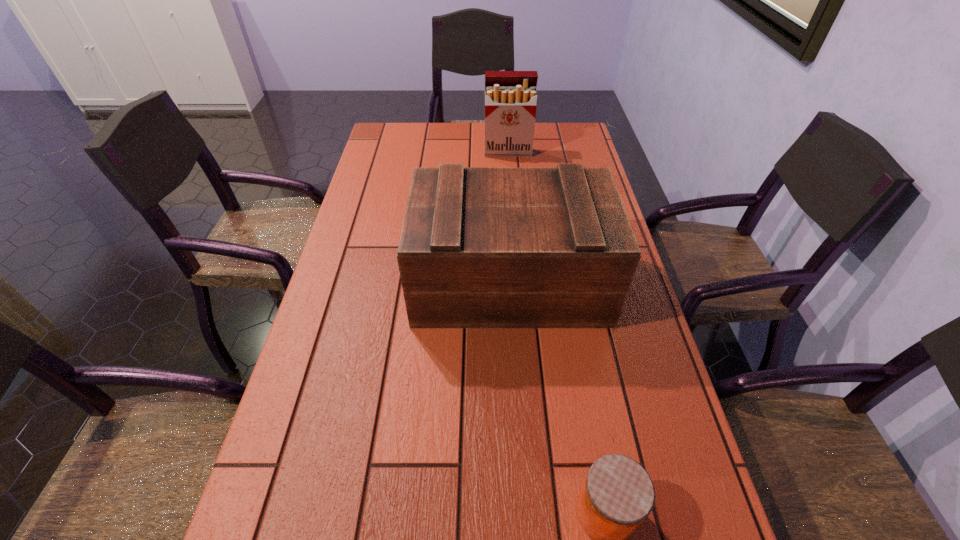
In the image, there is a desktop. At what (x,y) coordinates should I click in order to perform the action: click on vacant space at the far right corner. Please return your answer as a coordinate pair (x, y). Looking at the image, I should click on (579, 153).

In order to click on object that stands as the closest to the farthest object in this screenshot , I will do `click(481, 247)`.

Where is `object that can be found as the second closest to the box`? object that can be found as the second closest to the box is located at coordinates (510, 96).